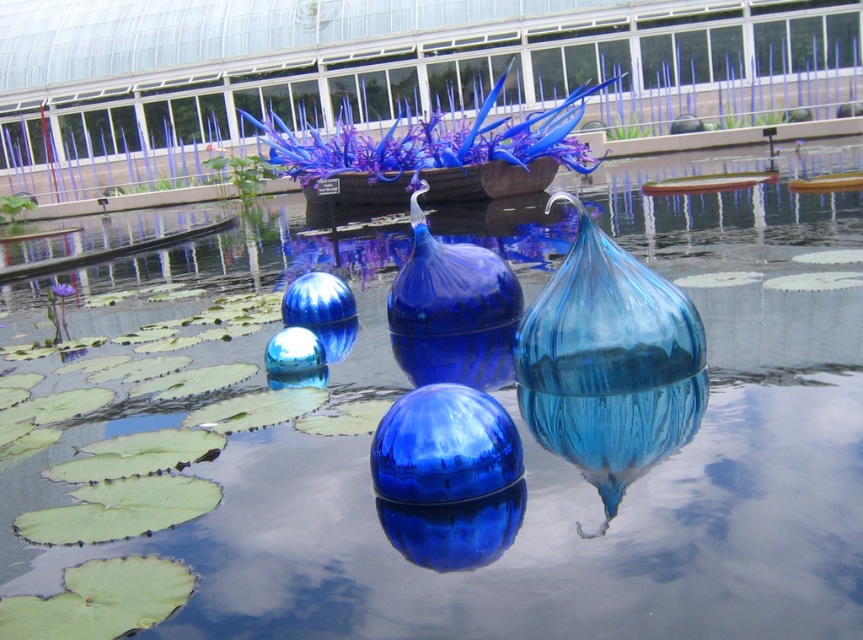
Looking at this image, you are a visitor in the garden and want to find the blue glass vase at center. Based on the coordinates provided, can you determine its position relative to the greenhouse in the background?

The blue glass vase at center is located at point [605,323], which places it near the center of the garden scene, closer to the foreground than the background greenhouse. Since the greenhouse is in the background, the blue glass vase at center is positioned in front of the greenhouse.